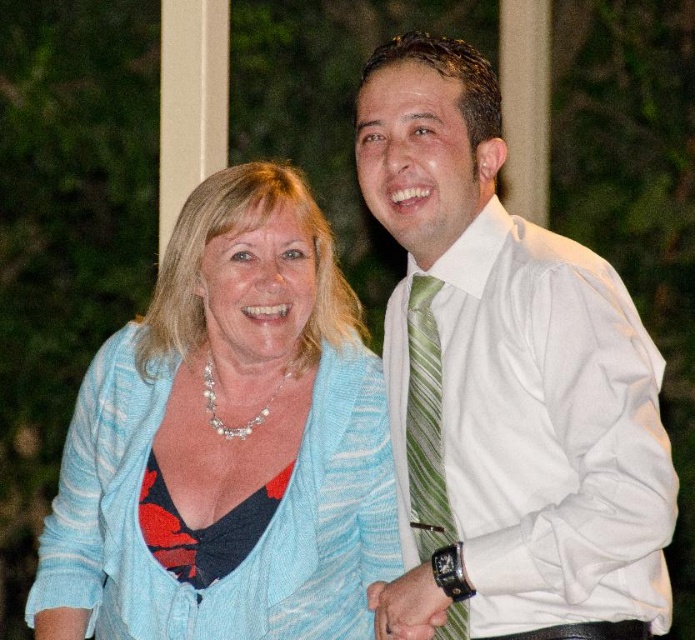
Question: Among these objects, which one is nearest to the camera?

Choices:
 (A) white smooth shirt at center
 (B) green striped tie at right
 (C) light blue knit cardigan at center

Answer: (A)

Question: Which point appears closest to the camera in this image?

Choices:
 (A) (457, 422)
 (B) (427, 481)

Answer: (A)

Question: Which object is the farthest from the light blue knit cardigan at center?

Choices:
 (A) green striped tie at right
 (B) white smooth shirt at center

Answer: (A)

Question: Can you confirm if light blue knit cardigan at center is positioned to the left of green striped tie at right?

Choices:
 (A) no
 (B) yes

Answer: (B)

Question: Can you confirm if white smooth shirt at center is positioned to the right of green striped tie at right?

Choices:
 (A) yes
 (B) no

Answer: (A)

Question: Does white smooth shirt at center have a smaller size compared to green striped tie at right?

Choices:
 (A) no
 (B) yes

Answer: (A)